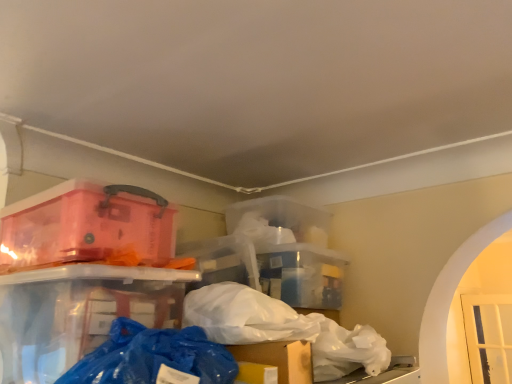
The image size is (512, 384). I want to click on white matte plastic bag at center, the second plastic bag from the left, so click(347, 350).

The image size is (512, 384). In order to click on white matte plastic bag at center, the second plastic bag from the left in this screenshot , I will do 347,350.

Where is `box on the left of white matte plastic bag at center, the second plastic bag from the left`? This screenshot has width=512, height=384. box on the left of white matte plastic bag at center, the second plastic bag from the left is located at coordinates (85, 226).

Between transparent plastic container at upper left and white matte plastic bag at center, placed as the 1th plastic bag when sorted from back to front, which one is positioned in front?

transparent plastic container at upper left is more forward.

Considering the positions of objects transparent plastic container at upper left and white matte plastic bag at center, the first plastic bag viewed from the right, in the image provided, who is more to the left, transparent plastic container at upper left or white matte plastic bag at center, the first plastic bag viewed from the right,?

From the viewer's perspective, transparent plastic container at upper left appears more on the left side.

Measure the distance between transparent plastic container at upper left and white matte plastic bag at center, the second plastic bag from the left.

transparent plastic container at upper left is 21.73 inches from white matte plastic bag at center, the second plastic bag from the left.

Considering the sizes of objects white matte plastic bag at center, the second plastic bag from the left, and transparent plastic container at upper left in the image provided, who is bigger, white matte plastic bag at center, the second plastic bag from the left, or transparent plastic container at upper left?

With larger size is transparent plastic container at upper left.

Are white matte plastic bag at center, the second plastic bag from the left, and transparent plastic container at upper left far apart?

No, there isn't a large distance between white matte plastic bag at center, the second plastic bag from the left, and transparent plastic container at upper left.

Considering the points (351, 355) and (75, 215), which point is behind, point (351, 355) or point (75, 215)?

The point (351, 355) is farther from the camera.

From a real-world perspective, which is physically below, white matte plastic bag at center, placed as the 1th plastic bag when sorted from back to front, or transparent plastic container at upper left?

white matte plastic bag at center, placed as the 1th plastic bag when sorted from back to front, from a real-world perspective.

Considering the positions of objects blue plastic bag at lower center, acting as the first plastic bag starting from the front, and white matte plastic bag at center, marked as the second plastic bag in a front-to-back arrangement, in the image provided, who is behind, blue plastic bag at lower center, acting as the first plastic bag starting from the front, or white matte plastic bag at center, marked as the second plastic bag in a front-to-back arrangement,?

white matte plastic bag at center, marked as the second plastic bag in a front-to-back arrangement, is further from the camera.

In the scene shown: Can you tell me how much blue plastic bag at lower center, acting as the first plastic bag starting from the front, and white matte plastic bag at center, the first plastic bag viewed from the right, differ in facing direction?

0.000567 degrees separate the facing orientations of blue plastic bag at lower center, acting as the first plastic bag starting from the front, and white matte plastic bag at center, the first plastic bag viewed from the right.

Is blue plastic bag at lower center, positioned as the first plastic bag in left-to-right order, turned away from white matte plastic bag at center, the second plastic bag from the left?

No, blue plastic bag at lower center, positioned as the first plastic bag in left-to-right order, is not facing away from white matte plastic bag at center, the second plastic bag from the left.

Is transparent plastic container at upper left bigger than blue plastic bag at lower center, positioned as the first plastic bag in left-to-right order?

Yes.

From the image's perspective, does transparent plastic container at upper left appear lower than blue plastic bag at lower center, acting as the first plastic bag starting from the front?

No.

Consider the image. Is transparent plastic container at upper left in contact with blue plastic bag at lower center, positioned as the first plastic bag in left-to-right order?

There is a gap between transparent plastic container at upper left and blue plastic bag at lower center, positioned as the first plastic bag in left-to-right order.

From a real-world perspective, which is physically above, white matte plastic bag at center, placed as the 1th plastic bag when sorted from back to front, or blue plastic bag at lower center, acting as the first plastic bag starting from the front?

blue plastic bag at lower center, acting as the first plastic bag starting from the front.

Can you confirm if white matte plastic bag at center, the first plastic bag viewed from the right, is positioned to the right of blue plastic bag at lower center, positioned as the first plastic bag in left-to-right order?

Yes, white matte plastic bag at center, the first plastic bag viewed from the right, is to the right of blue plastic bag at lower center, positioned as the first plastic bag in left-to-right order.

Between point (321, 332) and point (200, 335), which one is positioned in front?

Positioned in front is point (200, 335).

How much distance is there between white matte plastic bag at center, placed as the 1th plastic bag when sorted from back to front, and blue plastic bag at lower center, acting as the first plastic bag starting from the front?

The distance of white matte plastic bag at center, placed as the 1th plastic bag when sorted from back to front, from blue plastic bag at lower center, acting as the first plastic bag starting from the front, is 15.50 inches.

Does blue plastic bag at lower center, acting as the first plastic bag starting from the front, touch transparent plastic container at upper left?

blue plastic bag at lower center, acting as the first plastic bag starting from the front, is not next to transparent plastic container at upper left, and they're not touching.

Is transparent plastic container at upper left located within blue plastic bag at lower center, the second plastic bag from the back?

No.

From the image's perspective, is blue plastic bag at lower center, the second plastic bag from the back, positioned above or below transparent plastic container at upper left?

Clearly, from the image's perspective, blue plastic bag at lower center, the second plastic bag from the back, is below transparent plastic container at upper left.

Is blue plastic bag at lower center, positioned as the first plastic bag in left-to-right order, thinner than transparent plastic container at upper left?

Correct, the width of blue plastic bag at lower center, positioned as the first plastic bag in left-to-right order, is less than that of transparent plastic container at upper left.

I want to click on box on the left of white matte plastic bag at center, marked as the second plastic bag in a front-to-back arrangement, so click(85, 226).

Where is `the 2nd plastic bag below the transparent plastic container at upper left (from a real-world perspective)`? The width and height of the screenshot is (512, 384). the 2nd plastic bag below the transparent plastic container at upper left (from a real-world perspective) is located at coordinates [347, 350].

Which object lies nearer to the anchor point white matte plastic bag at center, the second plastic bag from the left, transparent plastic container at upper left or blue plastic bag at lower center, positioned as the first plastic bag in left-to-right order?

blue plastic bag at lower center, positioned as the first plastic bag in left-to-right order, is closer to white matte plastic bag at center, the second plastic bag from the left.

From the image, which object appears to be farther from blue plastic bag at lower center, positioned as the first plastic bag in left-to-right order, white matte plastic bag at center, marked as the second plastic bag in a front-to-back arrangement, or transparent plastic container at upper left?

white matte plastic bag at center, marked as the second plastic bag in a front-to-back arrangement, lies further to blue plastic bag at lower center, positioned as the first plastic bag in left-to-right order, than the other object.

When comparing their distances from transparent plastic container at upper left, does blue plastic bag at lower center, acting as the first plastic bag starting from the front, or white matte plastic bag at center, marked as the second plastic bag in a front-to-back arrangement, seem further?

white matte plastic bag at center, marked as the second plastic bag in a front-to-back arrangement, is further to transparent plastic container at upper left.

Based on their spatial positions, is white matte plastic bag at center, placed as the 1th plastic bag when sorted from back to front, or blue plastic bag at lower center, the second plastic bag from the back, closer to transparent plastic container at upper left?

Based on the image, blue plastic bag at lower center, the second plastic bag from the back, appears to be nearer to transparent plastic container at upper left.

From the image, which object appears to be nearer to white matte plastic bag at center, placed as the 1th plastic bag when sorted from back to front, blue plastic bag at lower center, the second plastic bag from the back, or transparent plastic container at upper left?

Based on the image, blue plastic bag at lower center, the second plastic bag from the back, appears to be nearer to white matte plastic bag at center, placed as the 1th plastic bag when sorted from back to front.

Considering their positions, is transparent plastic container at upper left positioned closer to blue plastic bag at lower center, positioned as the first plastic bag in left-to-right order, than white matte plastic bag at center, the second plastic bag from the left?

transparent plastic container at upper left.

Locate an element on the screen. plastic bag between transparent plastic container at upper left and white matte plastic bag at center, placed as the 1th plastic bag when sorted from back to front, in the horizontal direction is located at coordinates (152, 356).